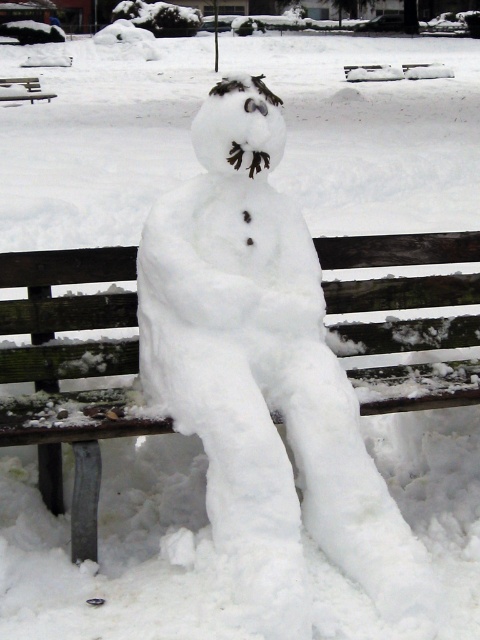
Question: Can you confirm if white fluffy snowman at center is wider than wooden bench at center?

Choices:
 (A) yes
 (B) no

Answer: (A)

Question: Is white fluffy snowman at center positioned before wooden bench at center?

Choices:
 (A) yes
 (B) no

Answer: (A)

Question: Does white fluffy snowman at center have a smaller size compared to brown wooden bench at upper left?

Choices:
 (A) no
 (B) yes

Answer: (B)

Question: Which point appears farthest from the camera in this image?

Choices:
 (A) (31, 80)
 (B) (149, 308)

Answer: (A)

Question: Among these objects, which one is farthest from the camera?

Choices:
 (A) white fluffy snowman at center
 (B) wooden bench at center
 (C) brown wooden bench at upper left

Answer: (C)

Question: Which object appears farthest from the camera in this image?

Choices:
 (A) wooden bench at center
 (B) white fluffy snowman at center

Answer: (A)